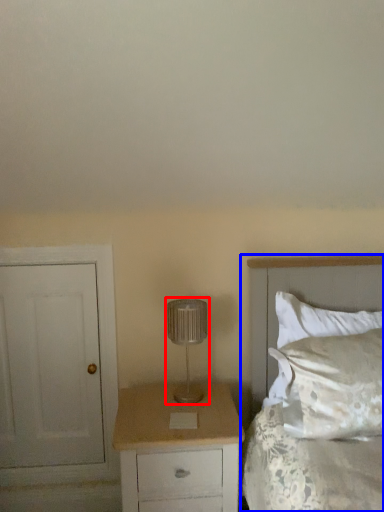
Question: Which object appears closest to the camera in this image, lamp (highlighted by a red box) or bed (highlighted by a blue box)?

Choices:
 (A) lamp
 (B) bed

Answer: (B)